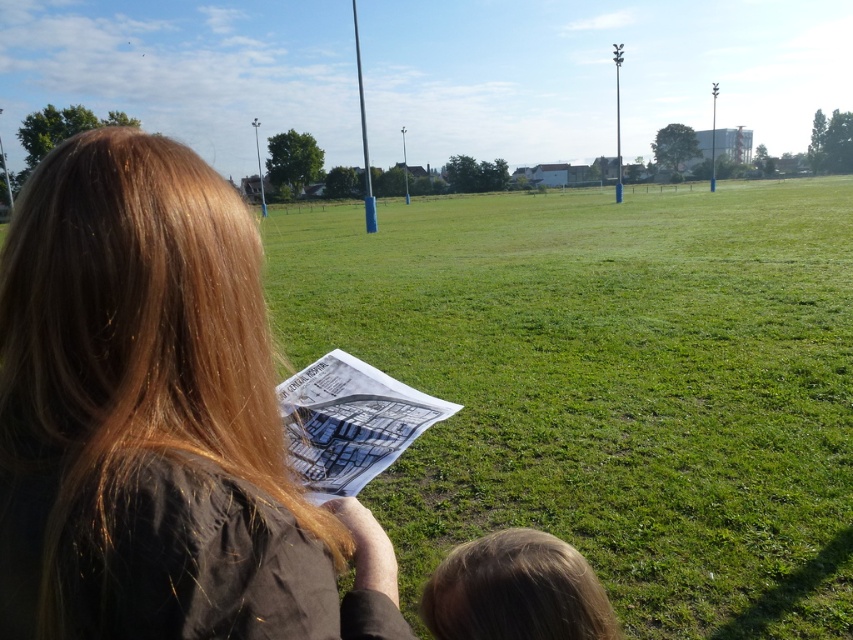
Between point (450, 374) and point (521, 554), which one is positioned behind?

Point (450, 374)

This screenshot has width=853, height=640. Find the location of `green grass field at center`. green grass field at center is located at coordinates (608, 385).

I want to click on green grass field at center, so click(608, 385).

Does green grass field at center appear under brown hair at left?

Actually, green grass field at center is above brown hair at left.

Does green grass field at center appear on the right side of brown hair at left?

Yes, green grass field at center is to the right of brown hair at left.

Locate an element on the screen. The width and height of the screenshot is (853, 640). green grass field at center is located at coordinates (608, 385).

Which is below, brown hair at left or blonde hair at lower center?

blonde hair at lower center is below.

Describe the element at coordinates (152, 417) in the screenshot. I see `brown hair at left` at that location.

At what (x,y) coordinates should I click in order to perform the action: click on brown hair at left. Please return your answer as a coordinate pair (x, y). This screenshot has height=640, width=853. Looking at the image, I should click on (152, 417).